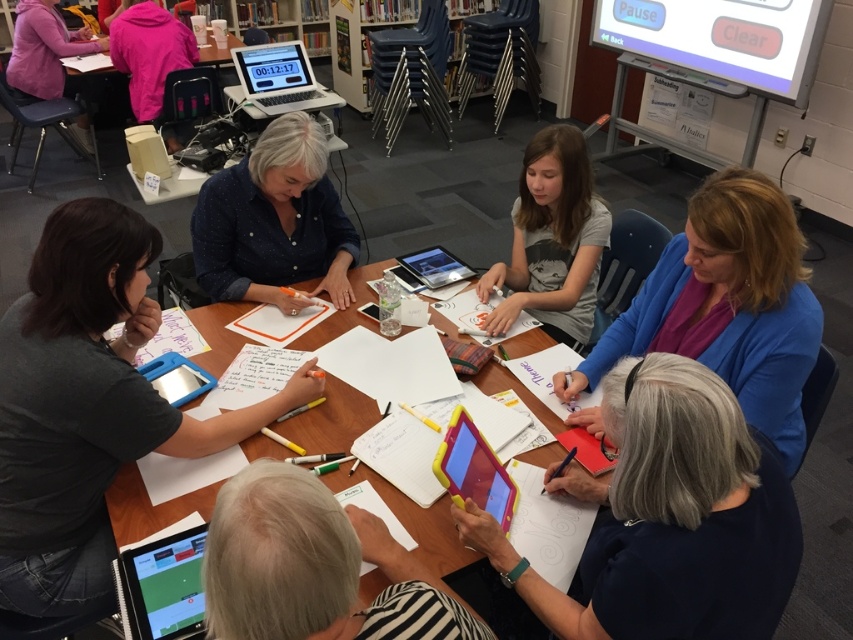
Question: Which object is positioned farthest from the blue fabric jacket at upper right?

Choices:
 (A) gray fabric shirt at lower right
 (B) silver metallic laptop at upper left

Answer: (B)

Question: Is gray fabric shirt at lower right to the right of silver metallic laptop at upper left from the viewer's perspective?

Choices:
 (A) no
 (B) yes

Answer: (B)

Question: Is the position of gray fabric shirt at lower right less distant than that of matte black tablet at lower left?

Choices:
 (A) no
 (B) yes

Answer: (B)

Question: Does yellow plastic tablet at lower center have a larger size compared to white paper at center?

Choices:
 (A) yes
 (B) no

Answer: (B)

Question: Which point is farther to the camera?

Choices:
 (A) matte black tablet at lower left
 (B) silver metallic laptop at upper left
 (C) gray fabric shirt at lower right

Answer: (B)

Question: Which of these objects is positioned farthest from the dark gray shirt at lower left?

Choices:
 (A) blue dotted shirt at center
 (B) matte pink hoodie at upper left
 (C) white paper at center
 (D) yellow plastic tablet at lower center

Answer: (B)